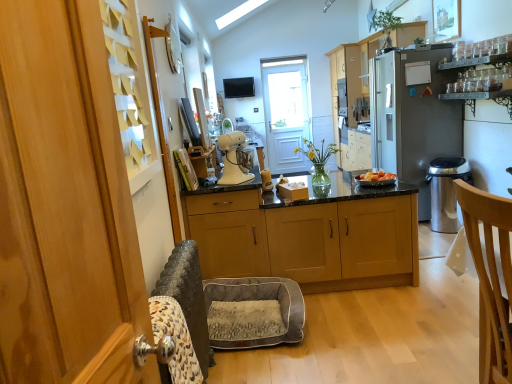
Question: Is there a large distance between white glossy stand mixer at center and green leafy plant at upper center, the first houseplant positioned from the top?

Choices:
 (A) yes
 (B) no

Answer: (A)

Question: Would you say white glossy stand mixer at center is outside green leafy plant at upper center, arranged as the second houseplant when ordered from the bottom?

Choices:
 (A) no
 (B) yes

Answer: (B)

Question: Is white glossy stand mixer at center further to the viewer compared to green leafy plant at upper center, arranged as the second houseplant when ordered from the bottom?

Choices:
 (A) yes
 (B) no

Answer: (B)

Question: Would you say white glossy stand mixer at center contains green leafy plant at upper center, which is the first houseplant in right-to-left order?

Choices:
 (A) yes
 (B) no

Answer: (B)

Question: Is white glossy stand mixer at center to the right of green leafy plant at upper center, arranged as the second houseplant when ordered from the bottom, from the viewer's perspective?

Choices:
 (A) no
 (B) yes

Answer: (A)

Question: Visually, is white wooden screen door at center positioned to the left or to the right of satin silver refrigerator at right?

Choices:
 (A) right
 (B) left

Answer: (B)

Question: Is white wooden screen door at center situated inside satin silver refrigerator at right or outside?

Choices:
 (A) outside
 (B) inside

Answer: (A)

Question: Relative to satin silver refrigerator at right, is white wooden screen door at center in front or behind?

Choices:
 (A) front
 (B) behind

Answer: (B)

Question: Is white wooden screen door at center taller or shorter than satin silver refrigerator at right?

Choices:
 (A) short
 (B) tall

Answer: (B)

Question: Would you say white wooden screen door at center is to the left or to the right of wooden cabinets at center, the second cabinetry in the top-to-bottom sequence, in the picture?

Choices:
 (A) left
 (B) right

Answer: (A)

Question: Is white wooden screen door at center inside the boundaries of wooden cabinets at center, which is counted as the first cabinetry, starting from the left, or outside?

Choices:
 (A) outside
 (B) inside

Answer: (A)

Question: In terms of size, does white wooden screen door at center appear bigger or smaller than wooden cabinets at center, which appears as the 1th cabinetry when viewed from the front?

Choices:
 (A) small
 (B) big

Answer: (A)

Question: From a real-world perspective, is white wooden screen door at center positioned above or below wooden cabinets at center, the second cabinetry in the top-to-bottom sequence?

Choices:
 (A) below
 (B) above

Answer: (B)

Question: Is satin silver refrigerator at right in front of or behind satin silver trash can at right in the image?

Choices:
 (A) front
 (B) behind

Answer: (B)

Question: From a real-world perspective, is satin silver refrigerator at right above or below satin silver trash can at right?

Choices:
 (A) below
 (B) above

Answer: (B)